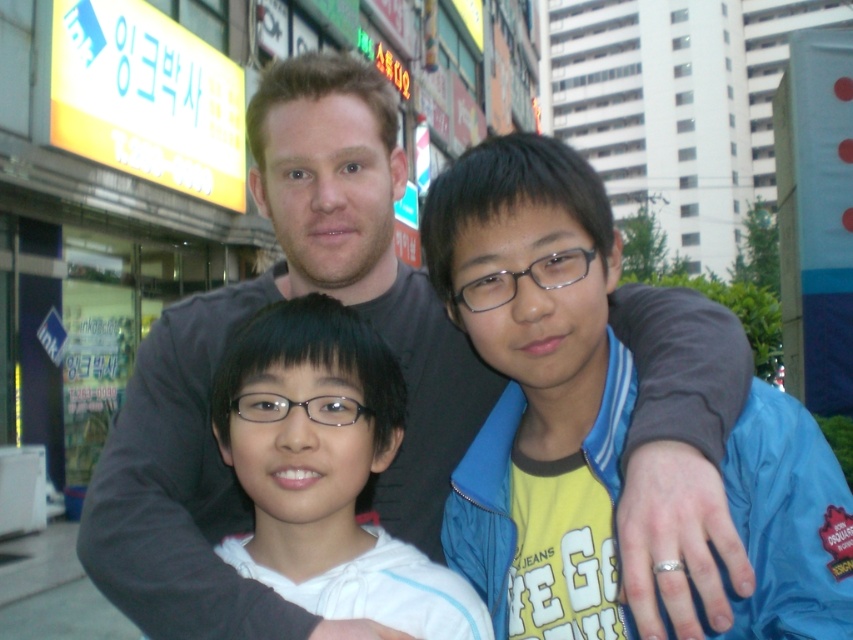
Question: Which point appears closest to the camera in this image?

Choices:
 (A) (310, 419)
 (B) (144, 620)

Answer: (A)

Question: Is blue fabric jacket at center to the right of white matte hoodie at center from the viewer's perspective?

Choices:
 (A) no
 (B) yes

Answer: (B)

Question: Does gray matte shirt at center appear over blue fabric jacket at center?

Choices:
 (A) no
 (B) yes

Answer: (B)

Question: Does blue fabric jacket at center have a lesser width compared to white matte hoodie at center?

Choices:
 (A) yes
 (B) no

Answer: (A)

Question: Which object appears closest to the camera in this image?

Choices:
 (A) white matte hoodie at center
 (B) gray matte shirt at center
 (C) blue fabric jacket at center

Answer: (B)

Question: Estimate the real-world distances between objects in this image. Which object is farther from the white matte hoodie at center?

Choices:
 (A) gray matte shirt at center
 (B) blue fabric jacket at center

Answer: (B)